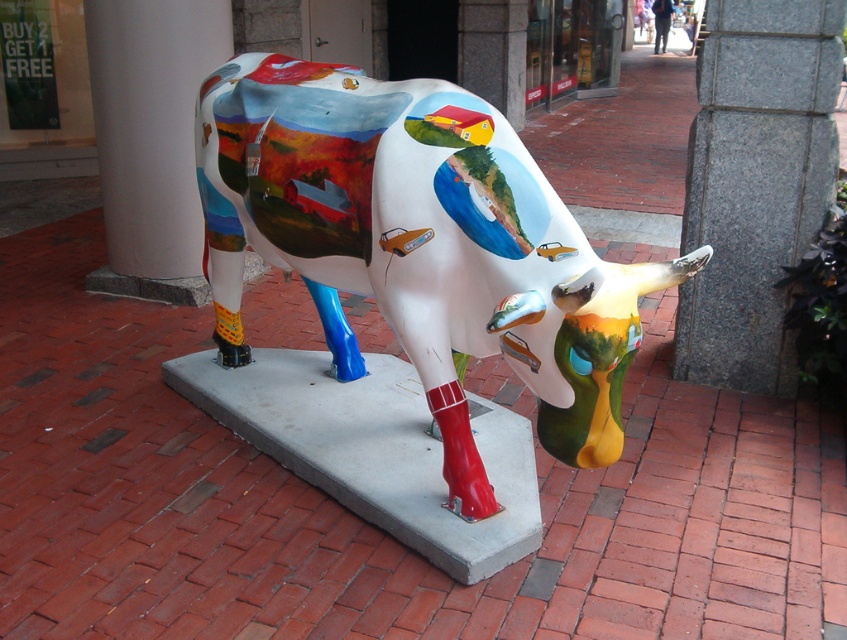
You are an artist who wants to place a new sculpture between the painted ceramic cow at center and the white smooth pillar at upper left. Which object should the sculpture be closer to in order to maintain a balanced composition?

The painted ceramic cow at center is shorter than the white smooth pillar at upper left. To maintain balance, the new sculpture should be placed closer to the taller white smooth pillar at upper left.